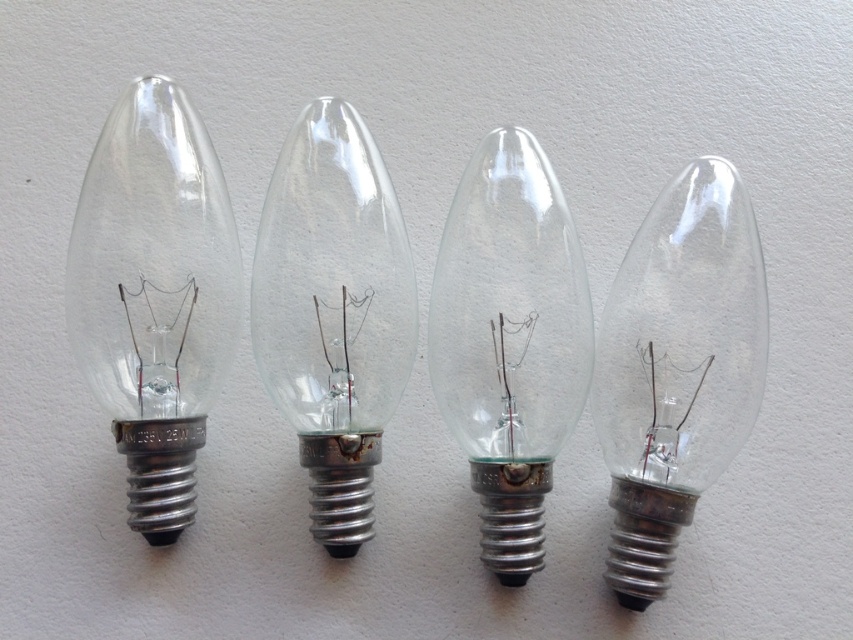
Question: Which object is the farthest from the transparent glass bulb at right?

Choices:
 (A) transparent glass light bulb at left
 (B) clear glass bulb at center
 (C) transparent glass light bulb at center

Answer: (A)

Question: Which object appears farthest from the camera in this image?

Choices:
 (A) clear glass bulb at center
 (B) transparent glass light bulb at left

Answer: (A)

Question: Can you confirm if transparent glass light bulb at left is positioned to the left of clear glass bulb at center?

Choices:
 (A) no
 (B) yes

Answer: (B)

Question: Does transparent glass light bulb at left appear under clear glass bulb at center?

Choices:
 (A) no
 (B) yes

Answer: (A)

Question: Does transparent glass light bulb at center have a larger size compared to clear glass bulb at center?

Choices:
 (A) yes
 (B) no

Answer: (B)

Question: Which of the following is the closest to the observer?

Choices:
 (A) (370, 144)
 (B) (688, 234)
 (C) (195, 276)

Answer: (B)